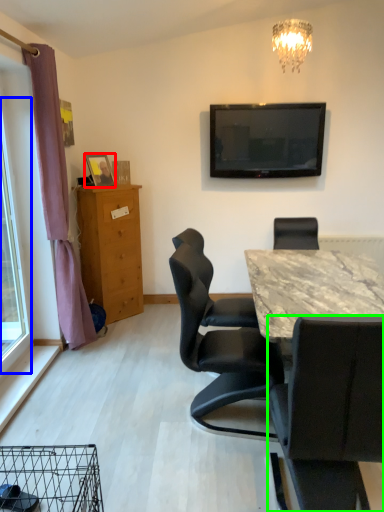
Question: Estimate the real-world distances between objects in this image. Which object is closer to picture frame (highlighted by a red box), glass door (highlighted by a blue box) or chair (highlighted by a green box)?

Choices:
 (A) glass door
 (B) chair

Answer: (A)